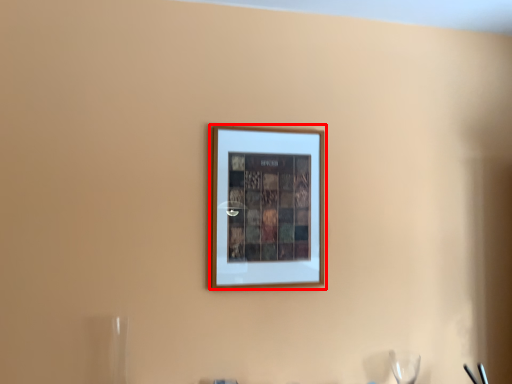
Question: From the image's perspective, what is the correct spatial relationship of picture frame (annotated by the red box) in relation to wine glass?

Choices:
 (A) below
 (B) above

Answer: (B)